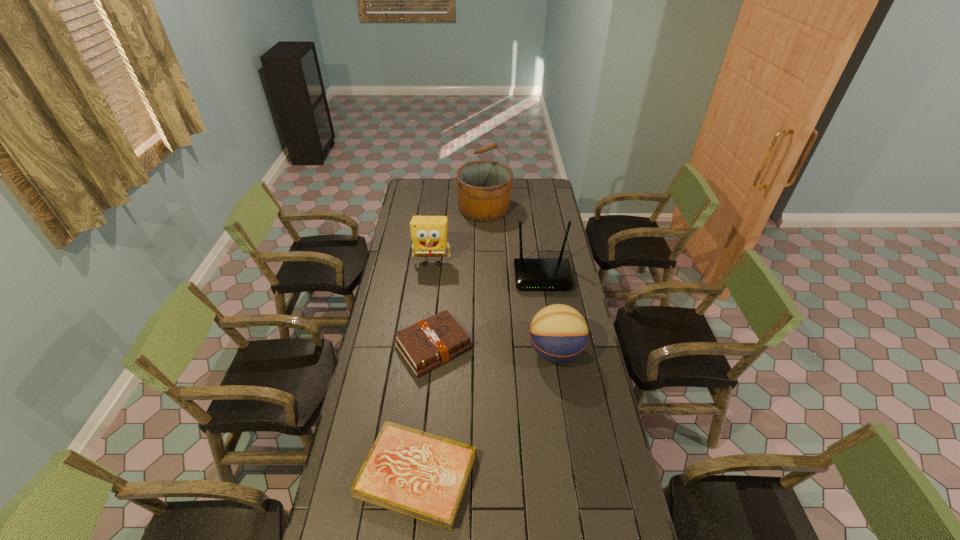
Find the location of a particular element. The image size is (960, 540). basketball at the right edge is located at coordinates (558, 333).

Image resolution: width=960 pixels, height=540 pixels. What are the coordinates of `free space at the far edge of the desktop` in the screenshot? It's located at (441, 198).

Locate an element on the screen. vacant space at the left edge of the desktop is located at coordinates (386, 347).

Image resolution: width=960 pixels, height=540 pixels. Identify the location of free spot at the right edge of the desktop. (541, 238).

The image size is (960, 540). I want to click on vacant point at the far right corner, so pyautogui.click(x=551, y=197).

You are a GUI agent. You are given a task and a screenshot of the screen. Output one action in this format:
    pyautogui.click(x=<x>, y=<y>)
    Task: Click on the free space between the router and the sponge
    Image resolution: width=960 pixels, height=540 pixels.
    Given the screenshot: What is the action you would take?
    pyautogui.click(x=488, y=270)

Locate an element on the screen. unoccupied position between the router and the sponge is located at coordinates (488, 270).

You are a GUI agent. You are given a task and a screenshot of the screen. Output one action in this format:
    pyautogui.click(x=<x>, y=<y>)
    Task: Click on the free spot between the router and the nearer hardback book
    
    Given the screenshot: What is the action you would take?
    pyautogui.click(x=480, y=376)

You are a GUI agent. You are given a task and a screenshot of the screen. Output one action in this format:
    pyautogui.click(x=<x>, y=<y>)
    Task: Click on the unoccupied area between the basketball and the sponge
    
    Given the screenshot: What is the action you would take?
    pyautogui.click(x=493, y=307)

I want to click on unoccupied area between the farther hardback book and the router, so click(x=488, y=312).